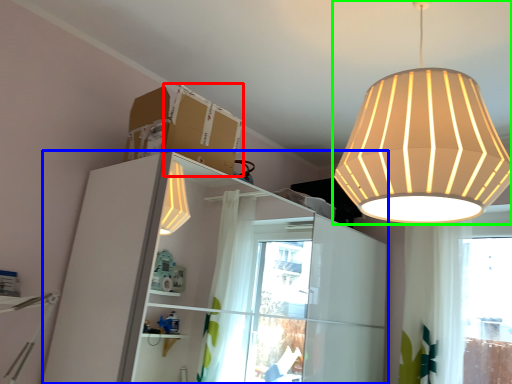
Question: Estimate the real-world distances between objects in this image. Which object is closer to cardboard box (highlighted by a red box), dresser (highlighted by a blue box) or lamp (highlighted by a green box)?

Choices:
 (A) dresser
 (B) lamp

Answer: (B)